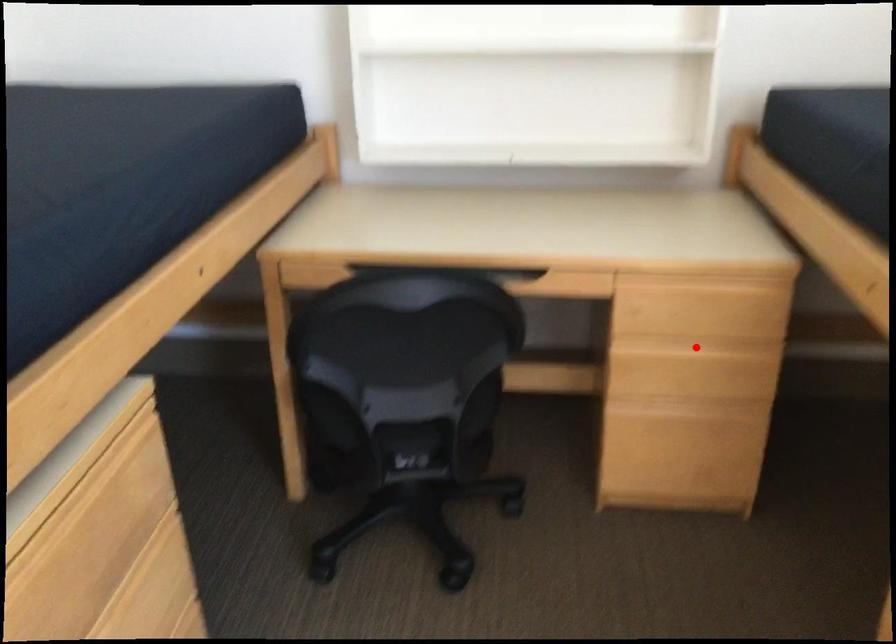
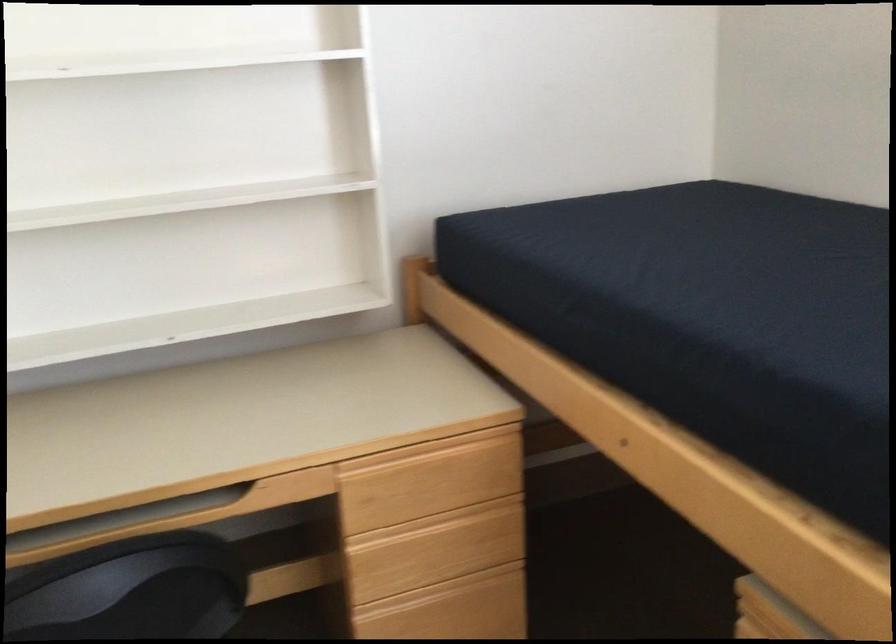
Question: I am providing you with two images of the same scene from different viewpoints. Given a red point in image1, look at the same physical point in image2. Is it:

Choices:
 (A) Closer to the viewpoint
 (B) Farther from the viewpoint

Answer: (A)